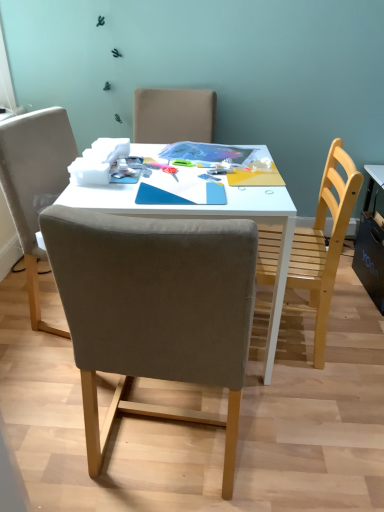
Question: Considering the positions of white glossy table at center and suede-like beige chair at center, acting as the 1th chair starting from the left, in the image, is white glossy table at center wider or thinner than suede-like beige chair at center, acting as the 1th chair starting from the left,?

Choices:
 (A) thin
 (B) wide

Answer: (B)

Question: From the image's perspective, relative to suede-like beige chair at center, which is the second chair from right to left, is white glossy table at center above or below?

Choices:
 (A) below
 (B) above

Answer: (B)

Question: Based on their relative distances, which object is farther from the wooden chair at right, the 1th chair viewed from the right?

Choices:
 (A) white glossy table at center
 (B) suede-like beige chair at center, which is the second chair from right to left

Answer: (B)

Question: Which of these objects is positioned farthest from the suede-like beige chair at center, which is the second chair from right to left?

Choices:
 (A) white glossy table at center
 (B) wooden chair at right, the 1th chair viewed from the right

Answer: (B)